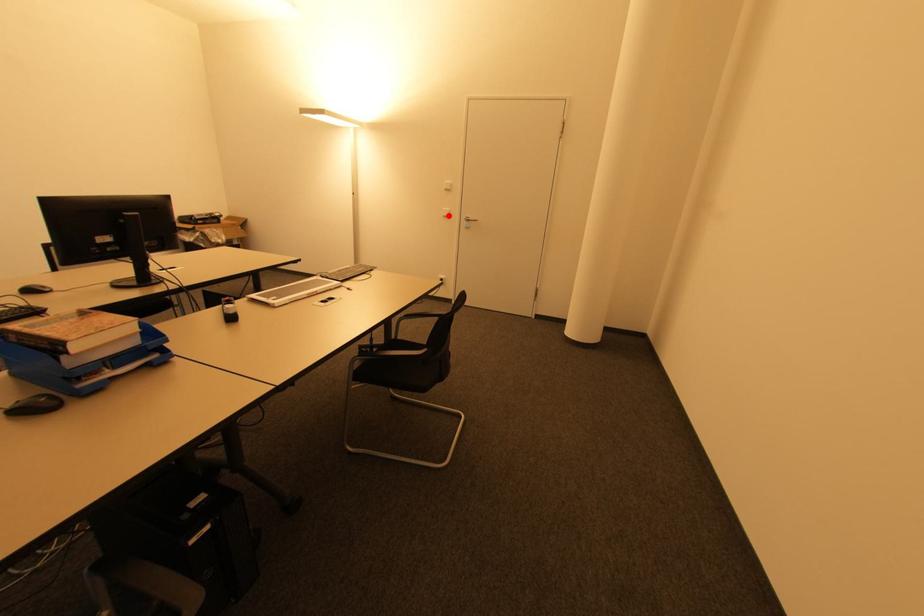
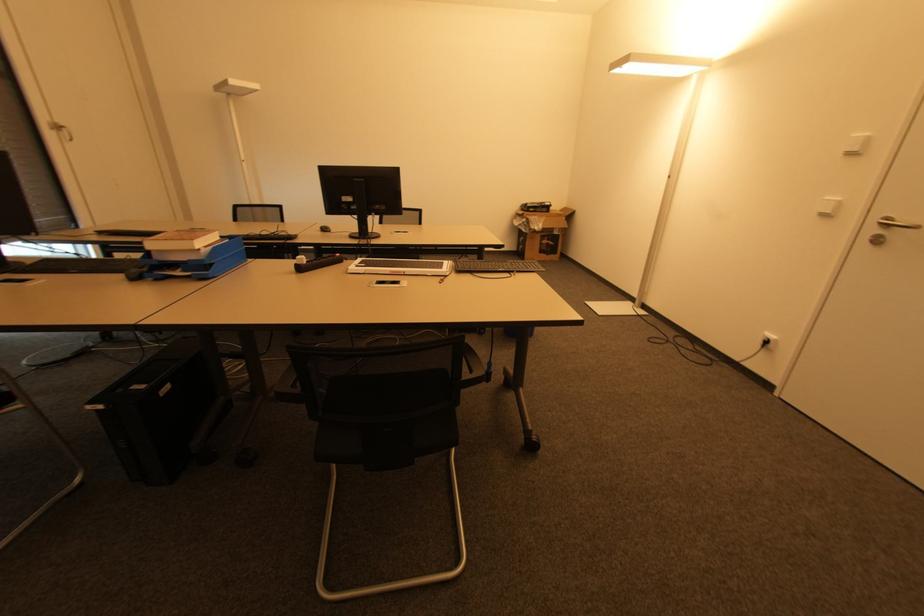
In the second image, find the point that corresponds to the highlighted location in the first image.

(832, 214)